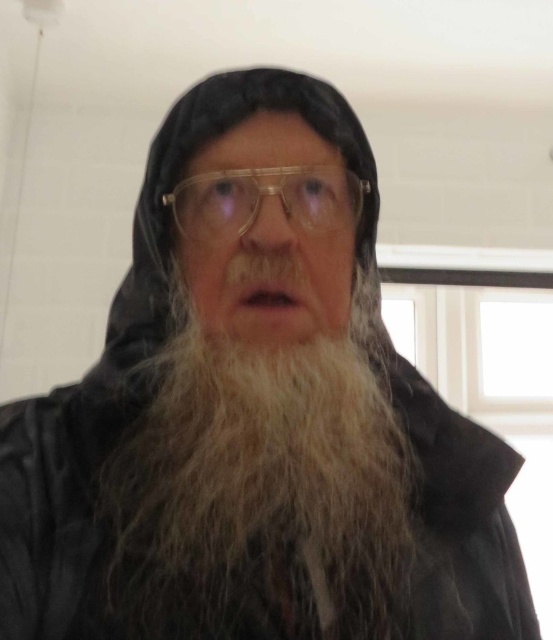
Question: Among these objects, which one is farthest from the camera?

Choices:
 (A) white fuzzy beard at center
 (B) transparent plastic glasses at center

Answer: (B)

Question: Is white fuzzy beard at center smaller than transparent plastic glasses at center?

Choices:
 (A) yes
 (B) no

Answer: (B)

Question: Which object appears closest to the camera in this image?

Choices:
 (A) transparent plastic glasses at center
 (B) white fuzzy beard at center

Answer: (B)

Question: Can you confirm if white fuzzy beard at center is positioned below transparent plastic glasses at center?

Choices:
 (A) no
 (B) yes

Answer: (B)

Question: Does white fuzzy beard at center have a smaller size compared to transparent plastic glasses at center?

Choices:
 (A) no
 (B) yes

Answer: (A)